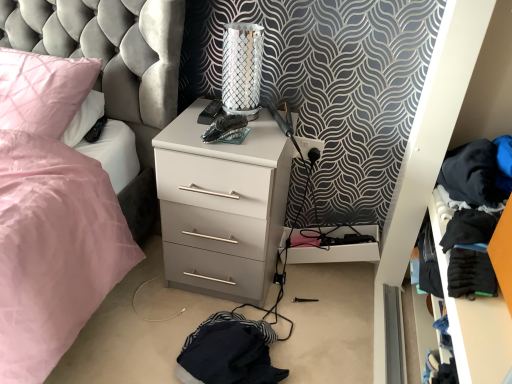
The width and height of the screenshot is (512, 384). I want to click on vacant region above white matte chest of drawers at center (from a real-world perspective), so click(223, 128).